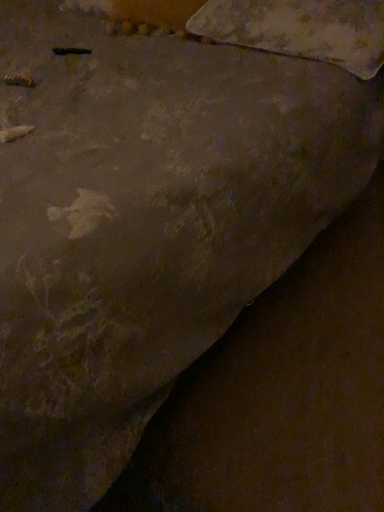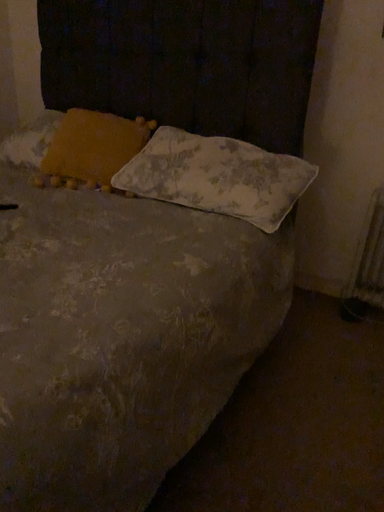
Question: How did the camera likely rotate when shooting the video?

Choices:
 (A) rotated right
 (B) rotated left

Answer: (A)